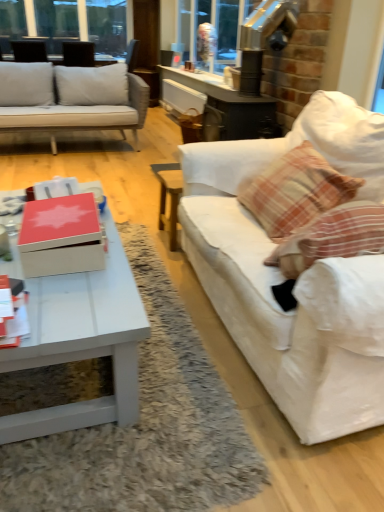
Question: Which is correct: clear glass window at upper left is inside white fabric couch at right, or outside of it?

Choices:
 (A) inside
 (B) outside

Answer: (B)

Question: Visually, is clear glass window at upper left positioned to the left or to the right of white fabric couch at right?

Choices:
 (A) left
 (B) right

Answer: (A)

Question: Which is farther from the matte red box at center?

Choices:
 (A) matte black armchair at upper left
 (B) clear glass window at upper left
 (C) white glossy coffee table at lower left
 (D) white fabric couch at right
 (E) plaid fabric pillow at right

Answer: (B)

Question: Considering the real-world distances, which object is farthest from the matte black armchair at upper left?

Choices:
 (A) white glossy coffee table at lower left
 (B) clear glass window at upper left
 (C) matte red box at center
 (D) white fabric couch at right
 (E) plaid fabric pillow at right

Answer: (A)